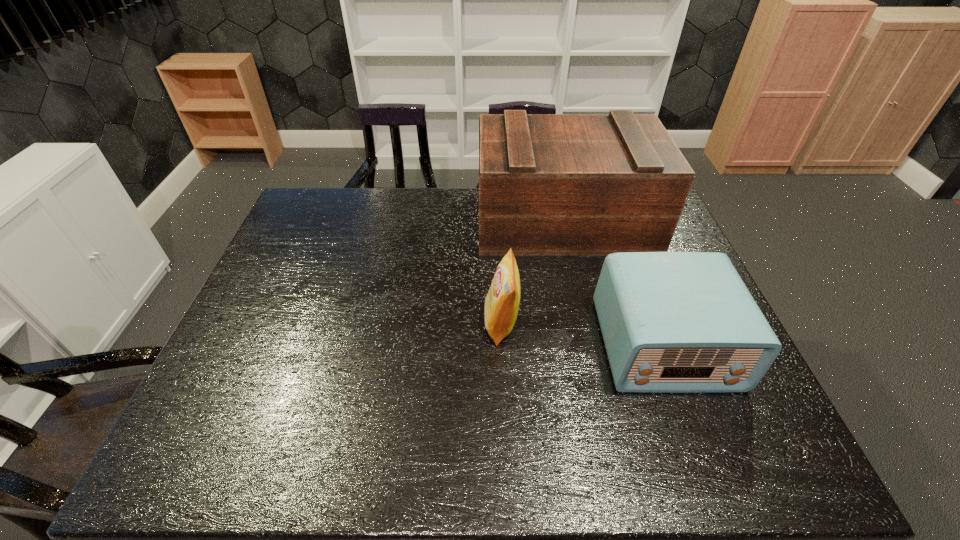
Identify the location of box that is at the right edge. (549, 184).

The width and height of the screenshot is (960, 540). Identify the location of radio receiver located in the right edge section of the desktop. (672, 322).

Where is `object positioned at the far right corner`? This screenshot has width=960, height=540. object positioned at the far right corner is located at coordinates (549, 184).

Locate an element on the screen. This screenshot has height=540, width=960. vacant space at the left edge of the desktop is located at coordinates (229, 381).

Locate an element on the screen. This screenshot has height=540, width=960. vacant space at the right edge of the desktop is located at coordinates (713, 427).

Locate an element on the screen. Image resolution: width=960 pixels, height=540 pixels. blank space at the far left corner of the desktop is located at coordinates (333, 215).

This screenshot has height=540, width=960. What are the coordinates of `vacant area at the near left corner` in the screenshot? It's located at (184, 458).

Locate an element on the screen. This screenshot has height=540, width=960. vacant region between the crisp (potato chip) and the radio receiver is located at coordinates (583, 334).

Where is `vacant space that is in between the crisp (potato chip) and the radio receiver`? This screenshot has height=540, width=960. vacant space that is in between the crisp (potato chip) and the radio receiver is located at coordinates (583, 334).

Where is `vacant space that is in between the farthest object and the crisp (potato chip)`? Image resolution: width=960 pixels, height=540 pixels. vacant space that is in between the farthest object and the crisp (potato chip) is located at coordinates (533, 272).